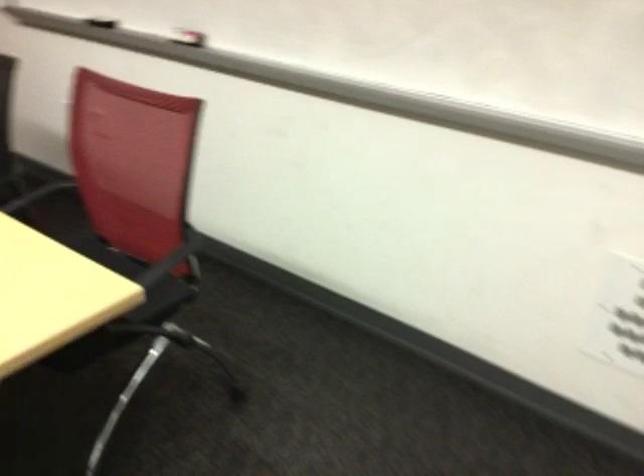
Identify the location of black whiteboard eraser. This screenshot has width=644, height=476. (102, 21).